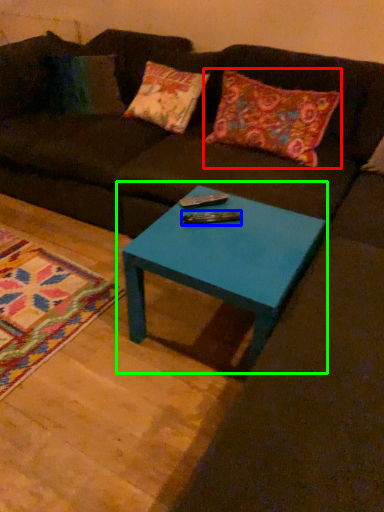
Question: Estimate the real-world distances between objects in this image. Which object is closer to pillow (highlighted by a red box), remote (highlighted by a blue box) or coffee table (highlighted by a green box)?

Choices:
 (A) remote
 (B) coffee table

Answer: (B)